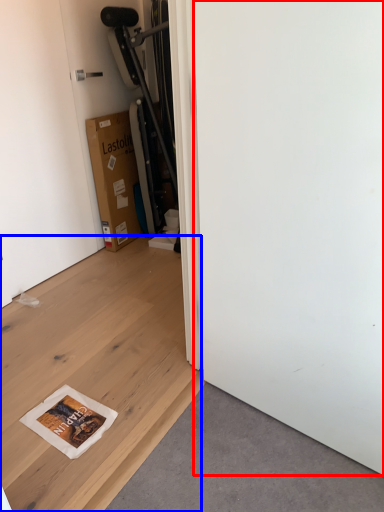
Question: Which object is closer to the camera taking this photo, screen door (highlighted by a red box) or plywood (highlighted by a blue box)?

Choices:
 (A) screen door
 (B) plywood

Answer: (A)